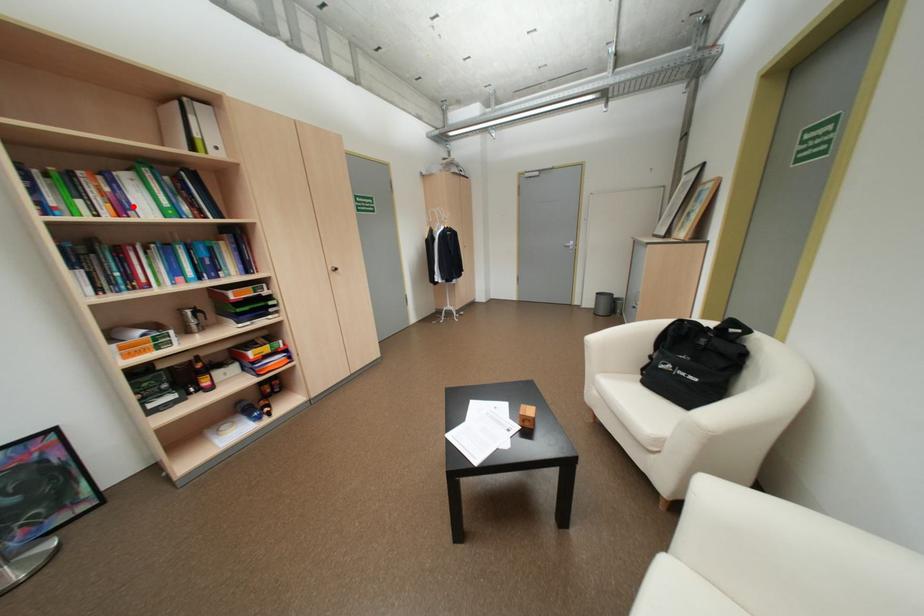
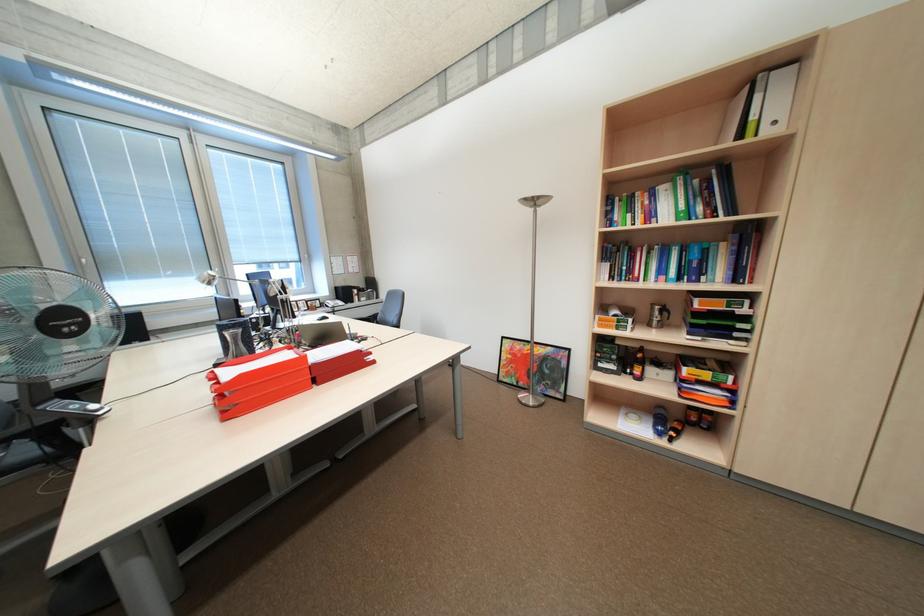
Question: I am providing you with two images of the same scene from different viewpoints. A red point is marked on the first image. At the location where the point appears in image 1, is it still visible in image 2?

Choices:
 (A) Yes
 (B) No

Answer: (A)